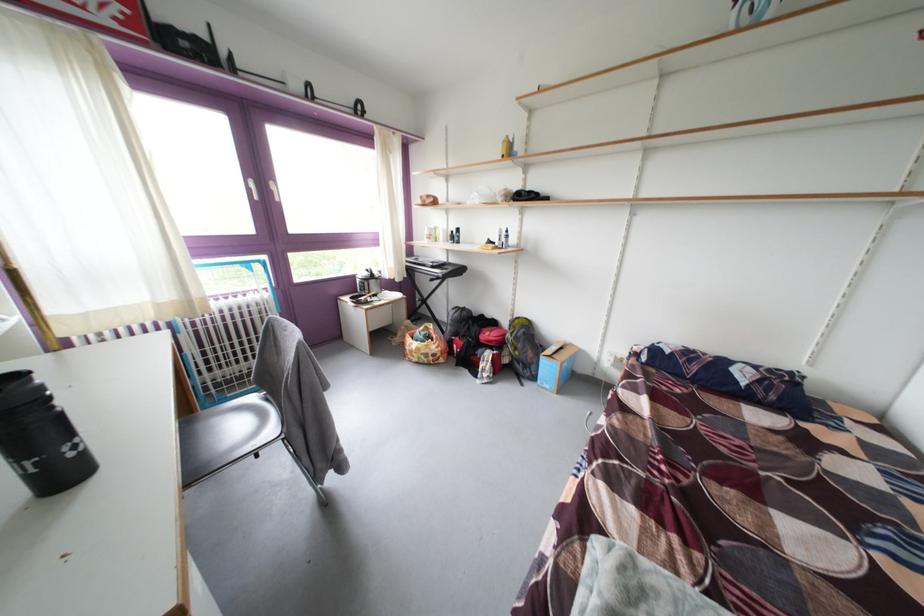
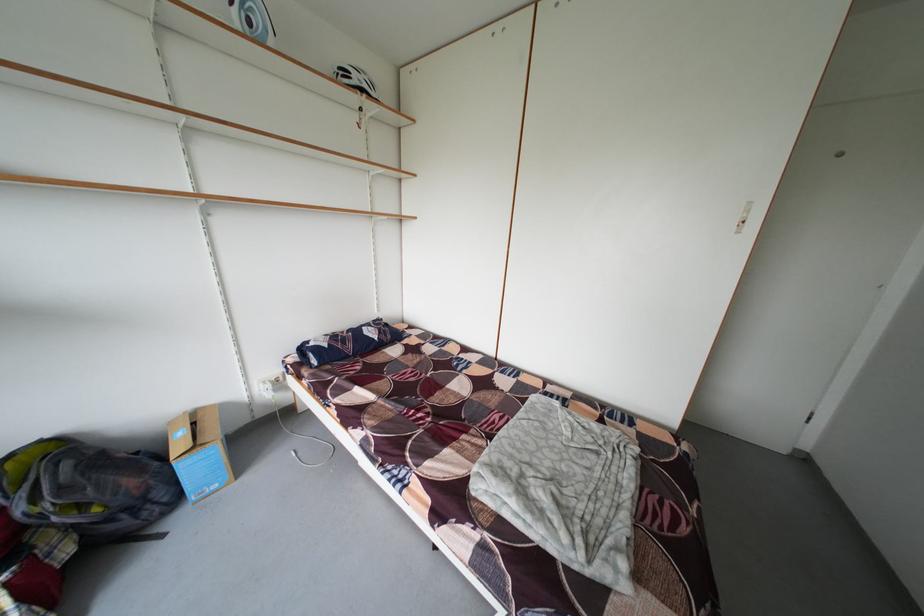
Where in the second image is the point corresponding to point 517,341 from the first image?

(31, 515)